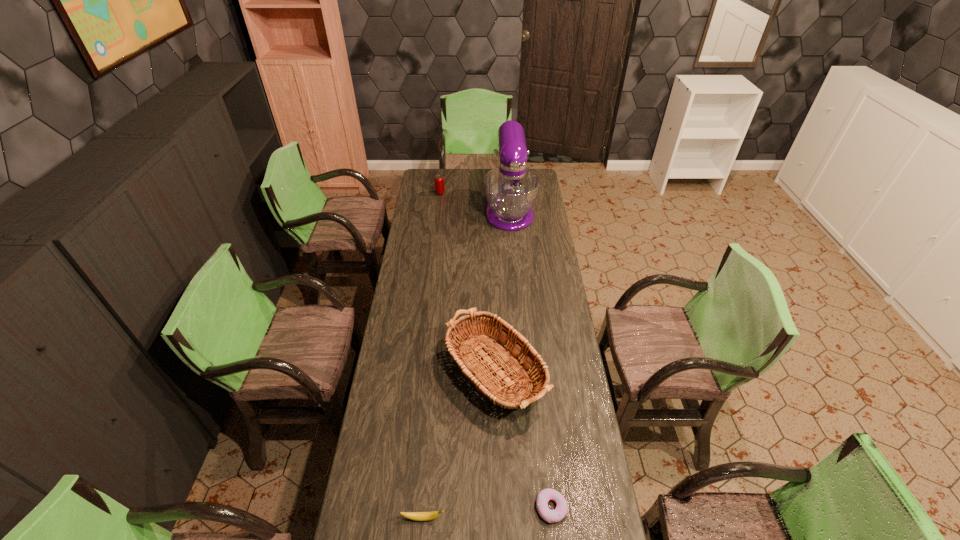
Locate an element on the screen. The height and width of the screenshot is (540, 960). blank space that satisfies the following two spatial constraints: 1. at the bowl opening of the tallest object; 2. on the right side of the shortest object is located at coordinates (535, 508).

This screenshot has width=960, height=540. In order to click on vacant space that satisfies the following two spatial constraints: 1. on the front side of the shortest object; 2. on the left side of the basket in this screenshot , I will do `click(495, 508)`.

At what (x,y) coordinates should I click in order to perform the action: click on vacant region that satisfies the following two spatial constraints: 1. at the bowl opening of the shortest object; 2. on the right side of the tallest object. Please return your answer as a coordinate pair (x, y). The image size is (960, 540). Looking at the image, I should click on (535, 508).

You are a GUI agent. You are given a task and a screenshot of the screen. Output one action in this format:
    pyautogui.click(x=<x>, y=<y>)
    Task: Click on the free location that satisfies the following two spatial constraints: 1. at the bowl opening of the doughnut; 2. on the left side of the tallest object
    The width and height of the screenshot is (960, 540).
    Given the screenshot: What is the action you would take?
    pyautogui.click(x=535, y=508)